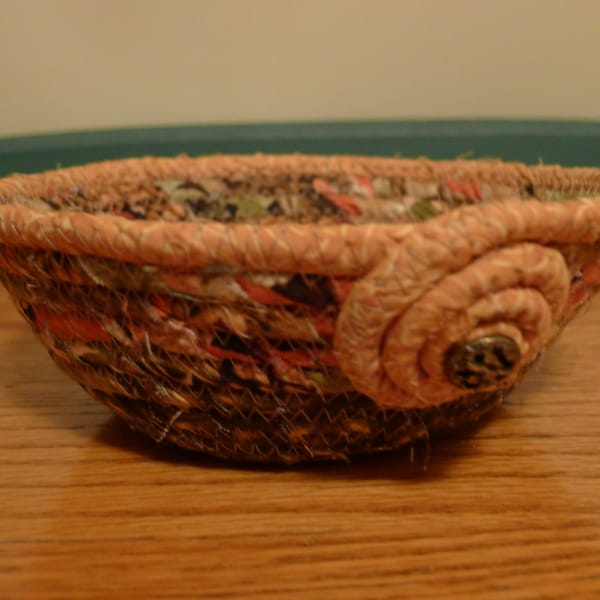
Where is `white wall`? white wall is located at coordinates (279, 47).